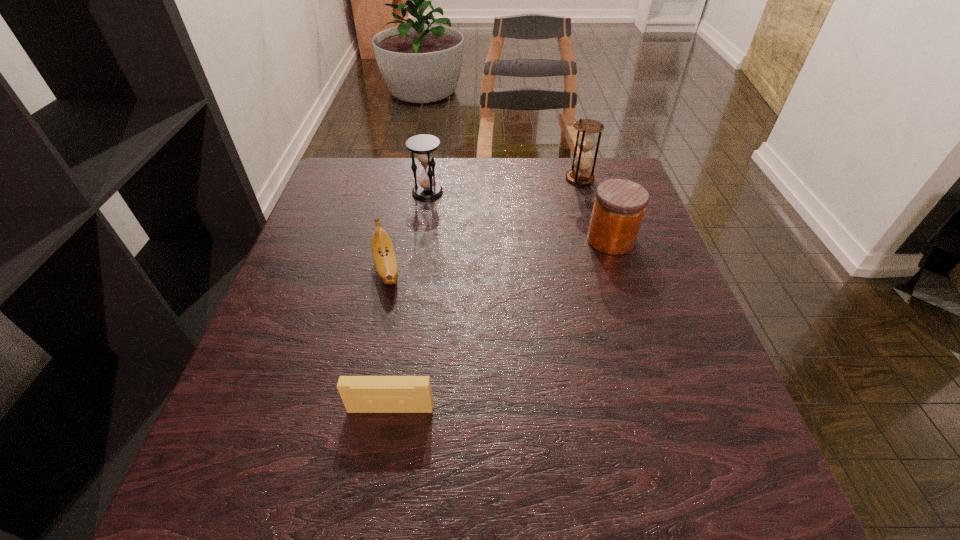
Where is `vacant region that satisfies the following two spatial constraints: 1. on the back side of the left hourglass; 2. on the left side of the banana`? vacant region that satisfies the following two spatial constraints: 1. on the back side of the left hourglass; 2. on the left side of the banana is located at coordinates (404, 192).

Where is `vacant space that satisfies the following two spatial constraints: 1. on the back side of the left hourglass; 2. on the right side of the right hourglass`? Image resolution: width=960 pixels, height=540 pixels. vacant space that satisfies the following two spatial constraints: 1. on the back side of the left hourglass; 2. on the right side of the right hourglass is located at coordinates (430, 178).